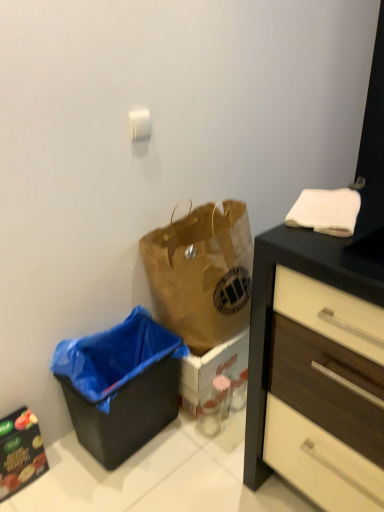
The width and height of the screenshot is (384, 512). Describe the element at coordinates (120, 385) in the screenshot. I see `black plastic recycling bin at lower left` at that location.

The width and height of the screenshot is (384, 512). Find the location of `brown paper bag at center`. brown paper bag at center is located at coordinates (202, 273).

Considering the positions of points (203, 290) and (73, 370), is point (203, 290) closer to camera compared to point (73, 370)?

That is False.

Is brown paper bag at center not inside black plastic recycling bin at lower left?

Indeed, brown paper bag at center is completely outside black plastic recycling bin at lower left.

Is brown paper bag at center to the left or to the right of black plastic recycling bin at lower left in the image?

brown paper bag at center is to the right of black plastic recycling bin at lower left.

Considering the relative sizes of brown paper bag at center and black plastic recycling bin at lower left in the image provided, is brown paper bag at center taller than black plastic recycling bin at lower left?

Correct, brown paper bag at center is much taller as black plastic recycling bin at lower left.

From a real-world perspective, which object rests below the other?

From a 3D spatial view, black glossy cabinet at lower left is below.

Is brown paper bag at center positioned before black glossy cabinet at lower left?

No.

Are brown paper bag at center and black glossy cabinet at lower left far apart?

No, there isn't a large distance between brown paper bag at center and black glossy cabinet at lower left.

Is brown paper bag at center taller than black glossy cabinet at lower left?

Yes.

Is black glossy cabinet at lower left bigger or smaller than brown paper bag at center?

Considering their sizes, black glossy cabinet at lower left takes up less space than brown paper bag at center.

Image resolution: width=384 pixels, height=512 pixels. I want to click on cabinetry in front of the brown paper bag at center, so click(20, 452).

From a real-world perspective, is black glossy cabinet at lower left physically located above or below brown paper bag at center?

black glossy cabinet at lower left is situated lower than brown paper bag at center in the real world.

Which of these two, black glossy cabinet at lower left or black plastic recycling bin at lower left, is smaller?

Smaller between the two is black glossy cabinet at lower left.

Does black glossy cabinet at lower left lie in front of black plastic recycling bin at lower left?

No, black glossy cabinet at lower left is behind black plastic recycling bin at lower left.

Is black glossy cabinet at lower left shorter than black plastic recycling bin at lower left?

Yes, black glossy cabinet at lower left is shorter than black plastic recycling bin at lower left.

Considering the positions of points (25, 409) and (107, 403), is point (25, 409) closer to camera compared to point (107, 403)?

No.

Where is `recycling bin that is under the brown paper bag at center (from a real-world perspective)`? recycling bin that is under the brown paper bag at center (from a real-world perspective) is located at coordinates (120, 385).

Is brown paper bag at center at the back of black plastic recycling bin at lower left?

black plastic recycling bin at lower left is not turned away from brown paper bag at center.

Looking at this image, can you confirm if black plastic recycling bin at lower left is taller than brown paper bag at center?

In fact, black plastic recycling bin at lower left may be shorter than brown paper bag at center.

Does black plastic recycling bin at lower left contain brown paper bag at center?

No, black plastic recycling bin at lower left does not contain brown paper bag at center.

From a real-world perspective, is black plastic recycling bin at lower left under black glossy cabinet at lower left?

Actually, black plastic recycling bin at lower left is physically above black glossy cabinet at lower left in the real world.

Are black plastic recycling bin at lower left and black glossy cabinet at lower left located far from each other?

Actually, black plastic recycling bin at lower left and black glossy cabinet at lower left are a little close together.

In the image, is black plastic recycling bin at lower left positioned in front of or behind black glossy cabinet at lower left?

In the image, black plastic recycling bin at lower left appears in front of black glossy cabinet at lower left.

Can you confirm if black plastic recycling bin at lower left is smaller than black glossy cabinet at lower left?

Actually, black plastic recycling bin at lower left might be larger than black glossy cabinet at lower left.

The image size is (384, 512). What are the coordinates of `handbag above the black plastic recycling bin at lower left (from a real-world perspective)` in the screenshot? It's located at (202, 273).

Locate an element on the screen. This screenshot has height=512, width=384. cabinetry on the left side of brown paper bag at center is located at coordinates (20, 452).

Consider the image. When comparing their distances from black plastic recycling bin at lower left, does black glossy cabinet at lower left or brown paper bag at center seem closer?

Among the two, brown paper bag at center is located nearer to black plastic recycling bin at lower left.

When comparing their distances from black glossy cabinet at lower left, does brown paper bag at center or black plastic recycling bin at lower left seem closer?

black plastic recycling bin at lower left lies closer to black glossy cabinet at lower left than the other object.

In the scene shown: Considering their positions, is black glossy cabinet at lower left positioned closer to brown paper bag at center than black plastic recycling bin at lower left?

Among the two, black plastic recycling bin at lower left is located nearer to brown paper bag at center.

Which object lies nearer to the anchor point black plastic recycling bin at lower left, brown paper bag at center or black glossy cabinet at lower left?

brown paper bag at center.

Looking at the image, which one is located further to black glossy cabinet at lower left, black plastic recycling bin at lower left or brown paper bag at center?

Among the two, brown paper bag at center is located further to black glossy cabinet at lower left.

Considering their positions, is black plastic recycling bin at lower left positioned closer to brown paper bag at center than black glossy cabinet at lower left?

black plastic recycling bin at lower left is closer to brown paper bag at center.

At what (x,y) coordinates should I click in order to perform the action: click on recycling bin between black glossy cabinet at lower left and brown paper bag at center. Please return your answer as a coordinate pair (x, y). The image size is (384, 512). Looking at the image, I should click on (120, 385).